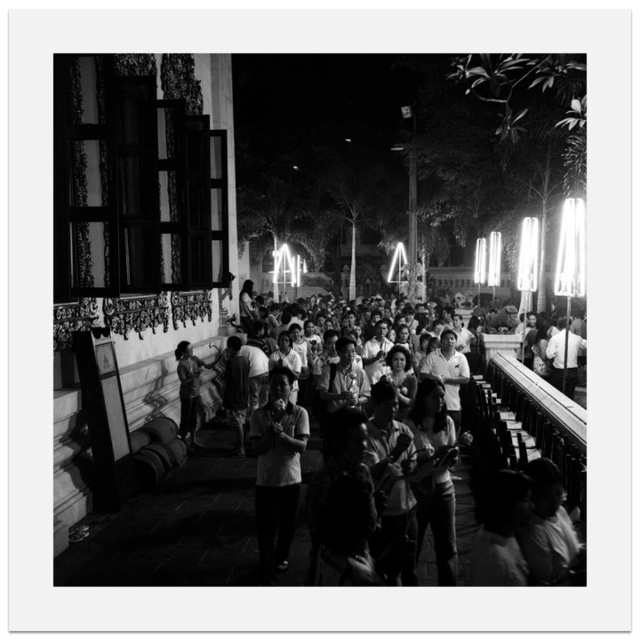
Question: Which of the following is the closest to the observer?

Choices:
 (A) smooth skin person at center
 (B) white matte shirt at center
 (C) dark skin textured shirt at center

Answer: (A)

Question: Is white matte shirt at center closer to the viewer compared to dark skin textured shirt at center?

Choices:
 (A) no
 (B) yes

Answer: (B)

Question: Can you confirm if smooth skin person at center is wider than white matte shirt at center?

Choices:
 (A) no
 (B) yes

Answer: (B)

Question: Which of these objects is positioned closest to the smooth skin person at center?

Choices:
 (A) white matte shirt at center
 (B) dark skin textured shirt at center

Answer: (A)

Question: Among these points, which one is nearest to the camera?

Choices:
 (A) (266, 458)
 (B) (520, 371)
 (C) (180, 410)

Answer: (A)

Question: Considering the relative positions of smooth skin person at center and dark skin textured shirt at center in the image provided, where is smooth skin person at center located with respect to dark skin textured shirt at center?

Choices:
 (A) right
 (B) left

Answer: (A)